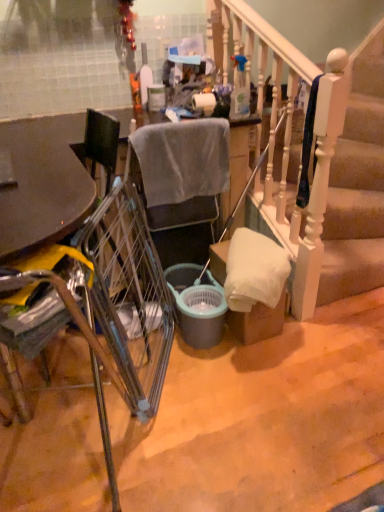
Where is `vacant space in front of metallic silver trolley at center`? This screenshot has height=512, width=384. vacant space in front of metallic silver trolley at center is located at coordinates (195, 446).